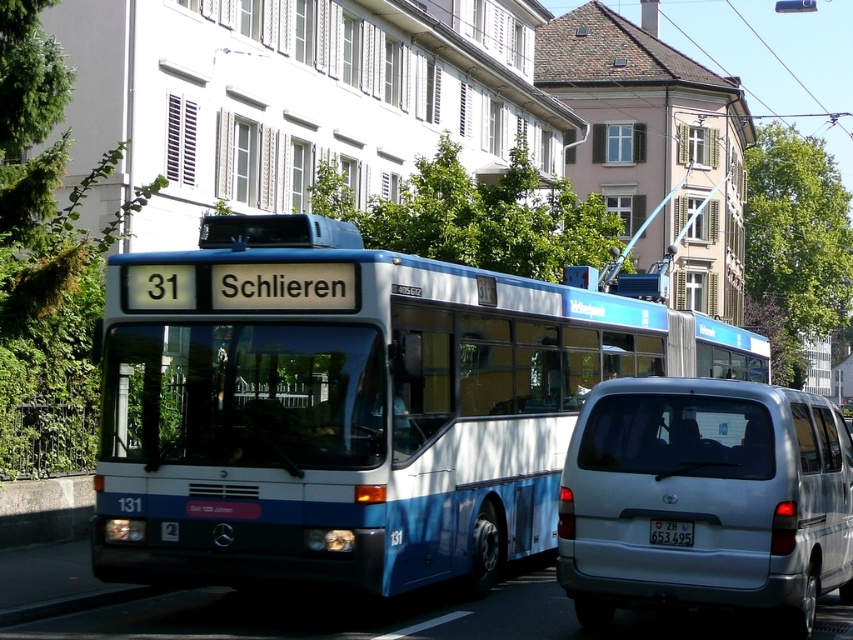
You are standing at the point marked by coordinates (352, 406) in the image. Which object are you closest to?

The point marked by coordinates (352, 406) is closest to the blue metallic bus at center.